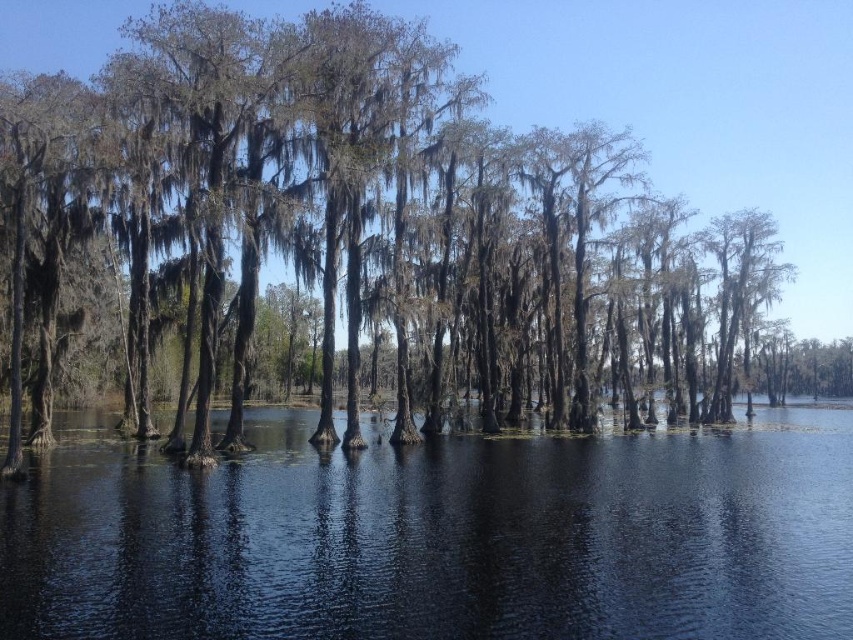
Who is higher up, transparent water at center or smooth bark trees at center?

smooth bark trees at center is higher up.

Is transparent water at center wider than smooth bark trees at center?

In fact, transparent water at center might be narrower than smooth bark trees at center.

Who is more distant from viewer, (107, 561) or (415, 8)?

The point (415, 8) is behind.

You are a GUI agent. You are given a task and a screenshot of the screen. Output one action in this format:
    pyautogui.click(x=<x>, y=<y>)
    Task: Click on the transparent water at center
    
    Given the screenshot: What is the action you would take?
    pyautogui.click(x=440, y=538)